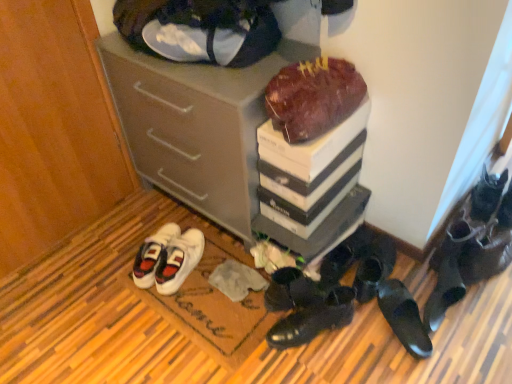
Identify the location of free space above black leather shoes at lower center, placed as the 8th footwear when sorted from right to left (from a real-world perspective). (316, 302).